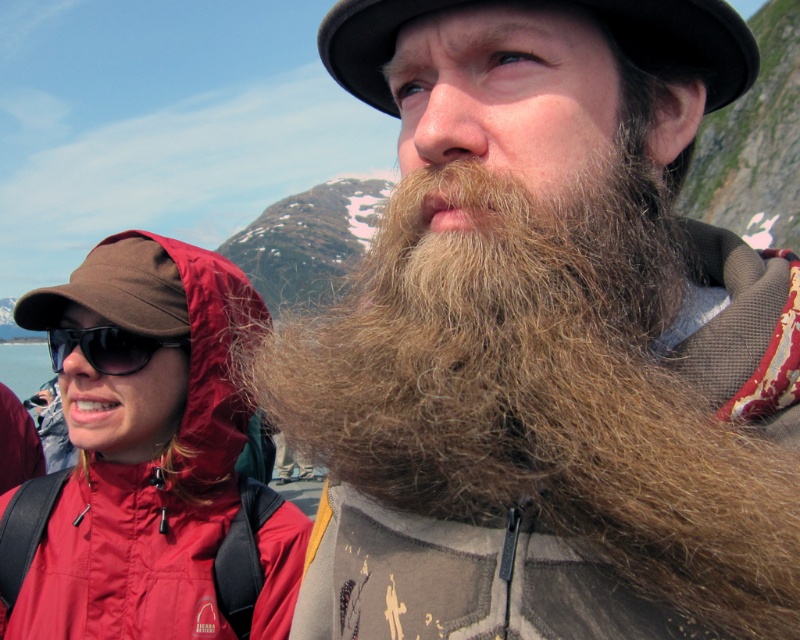
Is the position of brown fuzzy beard at center less distant than that of matte red jacket at left?

Yes, it is.

Is point (492, 477) less distant than point (94, 500)?

Yes, point (492, 477) is closer to viewer.

Is point (308, 326) in front of point (156, 524)?

Yes, point (308, 326) is in front of point (156, 524).

Find the location of `brown fuzzy beard at center`. brown fuzzy beard at center is located at coordinates (544, 416).

Between brown fuzzy beard at center and black plastic sunglasses at upper left, which one is positioned lower?

brown fuzzy beard at center is below.

Can you confirm if brown fuzzy beard at center is thinner than black plastic sunglasses at upper left?

→ Incorrect, brown fuzzy beard at center's width is not less than black plastic sunglasses at upper left's.

What do you see at coordinates (544, 416) in the screenshot?
I see `brown fuzzy beard at center` at bounding box center [544, 416].

Where is `brown fuzzy beard at center`? The width and height of the screenshot is (800, 640). brown fuzzy beard at center is located at coordinates (544, 416).

Does matte red jacket at left have a larger size compared to black plastic sunglasses at upper left?

Yes.

Does point (208, 403) lie in front of point (72, 333)?

No, it is not.

Image resolution: width=800 pixels, height=640 pixels. I want to click on matte red jacket at left, so 140,442.